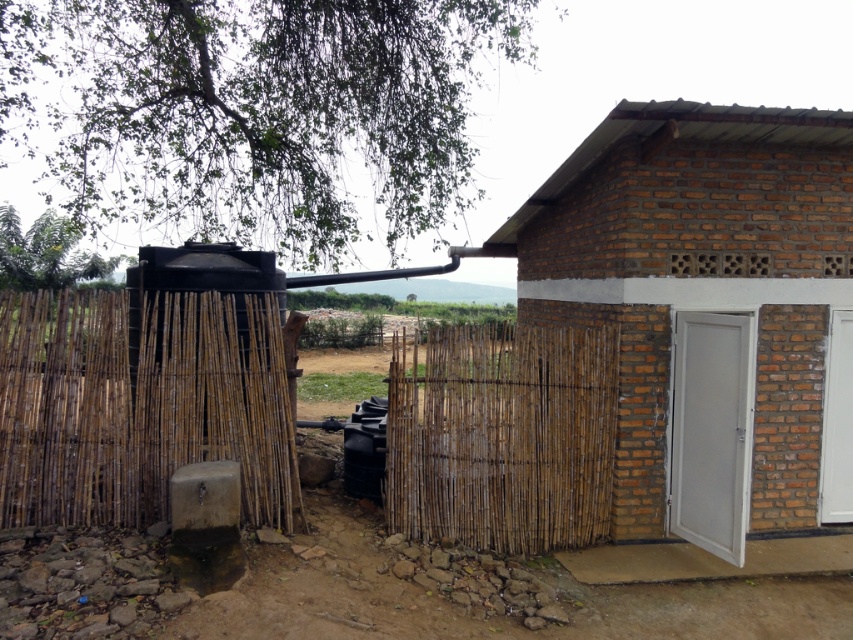
Question: Does brown brick door at center have a greater width compared to bamboo fence at left?

Choices:
 (A) no
 (B) yes

Answer: (B)

Question: Can you confirm if brown brick door at center is positioned to the left of bamboo fence at left?

Choices:
 (A) no
 (B) yes

Answer: (A)

Question: Does brown brick door at center have a smaller size compared to bamboo fence at left?

Choices:
 (A) yes
 (B) no

Answer: (B)

Question: Which of the following is the farthest from the observer?

Choices:
 (A) (460, 477)
 (B) (62, 401)

Answer: (A)

Question: Which of these objects is positioned farthest from the brown brick door at center?

Choices:
 (A) bamboo fence at left
 (B) bamboo fence at center

Answer: (A)

Question: Which is nearer to the bamboo fence at left?

Choices:
 (A) bamboo fence at center
 (B) brown brick door at center

Answer: (A)